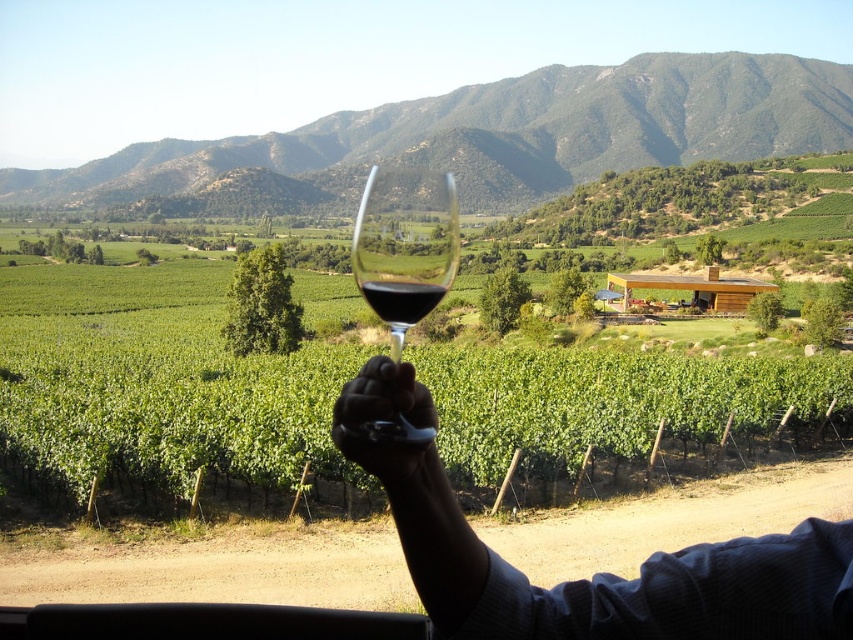
You are a photographer trying to capture both the green leafy vines at center and the silvery metallic knife at center in the same frame. Given their distance apart, can you estimate if they can be included in a single wide shot without zooming in?

The green leafy vines at center and silvery metallic knife at center are 70.27 meters apart. Depending on the camera lens, a wide angle lens might be able to capture both in one frame without zooming in, but this would require a sufficiently wide field of view to encompass 70.27 meters between the two objects.

You are a chef preparing a dish and need to cut a piece of meat. You have a silvery metallic knife at center and a translucent glass at center on the counter. Which object is more suitable for cutting the meat?

The silvery metallic knife at center is more suitable for cutting the meat because it is wider than the translucent glass at center, making it the appropriate tool for the task.

You are a chef preparing a dish and need to choose between the silvery metallic knife at center and the translucent glass at center. Which object is bigger?

The silvery metallic knife at center is larger in size compared to the translucent glass at center.